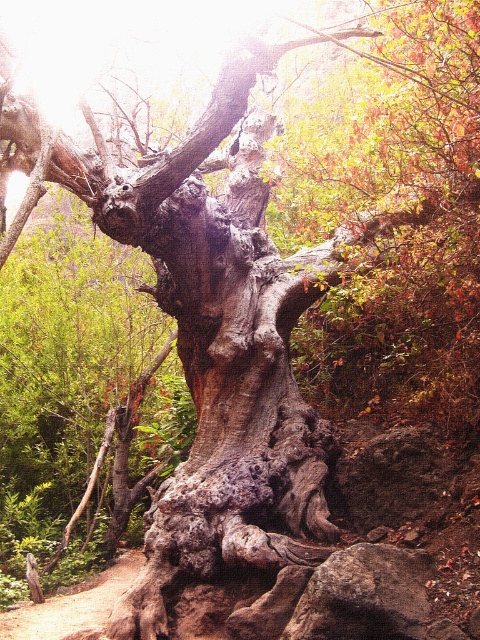
You are a hiker who wants to walk along the brown dirt trail at lower left but there is a gray rough rock at lower right in the way. Can you walk around it? Explain your reasoning based on their positions.

The gray rough rock at lower right is above the brown dirt trail at lower left, meaning the rock is positioned higher up. Since the trail is below, you can walk around the rock by moving along the trail beneath it.